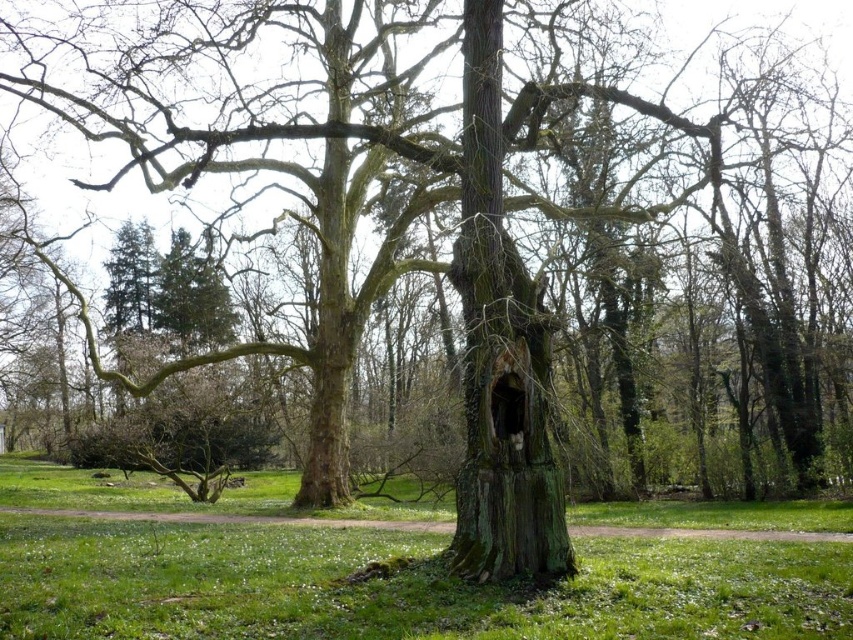
Question: Does green grass at center appear under green mossy tree trunk at center?

Choices:
 (A) no
 (B) yes

Answer: (B)

Question: Considering the relative positions of green grass at center and green mossy tree trunk at center in the image provided, where is green grass at center located with respect to green mossy tree trunk at center?

Choices:
 (A) below
 (B) above

Answer: (A)

Question: Which point appears farthest from the camera in this image?

Choices:
 (A) (494, 484)
 (B) (701, 509)

Answer: (B)

Question: Which of the following is the closest to the observer?

Choices:
 (A) green grass at center
 (B) green mossy tree trunk at center

Answer: (A)

Question: Where is green grass at center located in relation to green mossy tree trunk at center in the image?

Choices:
 (A) right
 (B) left

Answer: (B)